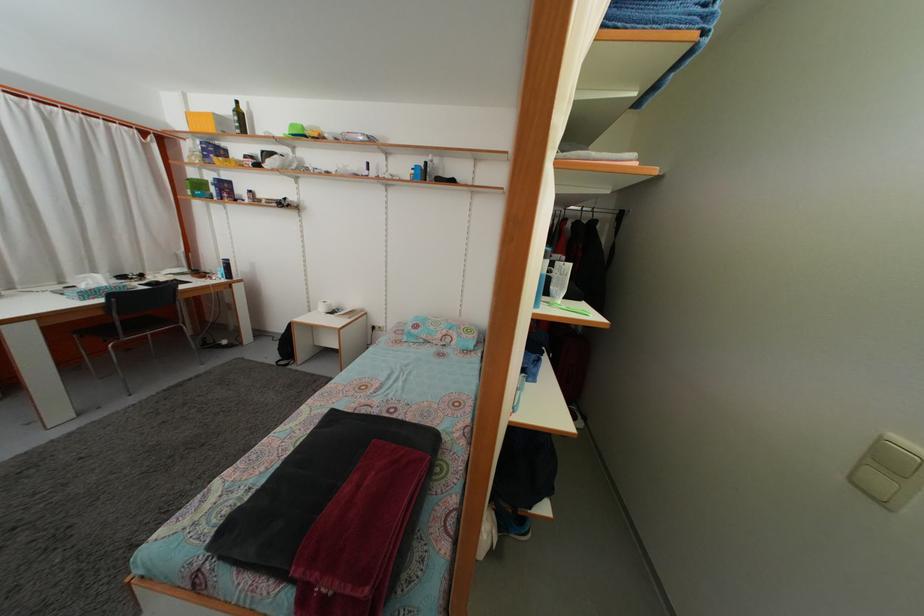
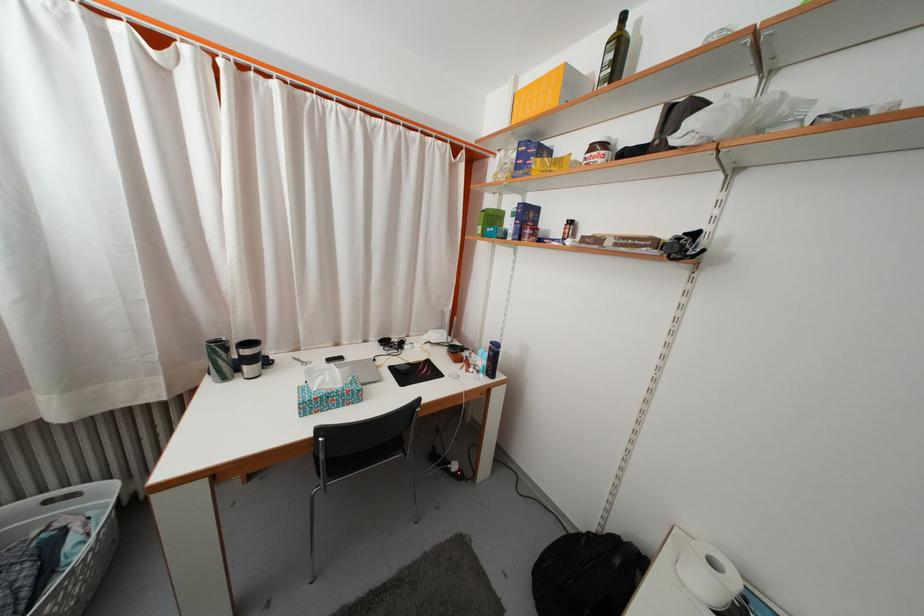
Where in the second image is the point corresponding to point (225, 127) from the first image?

(575, 84)